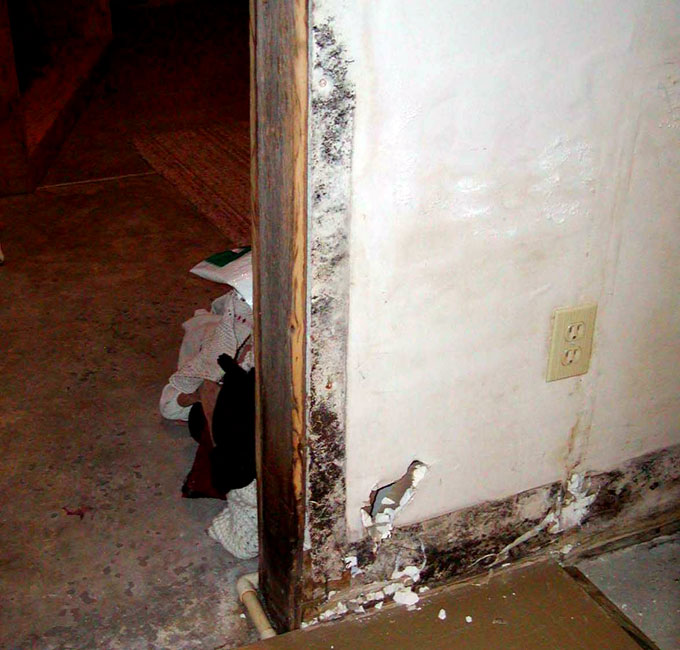
The height and width of the screenshot is (650, 680). I want to click on concrete subfloor, so click(x=62, y=424), click(x=119, y=276), click(x=126, y=481).